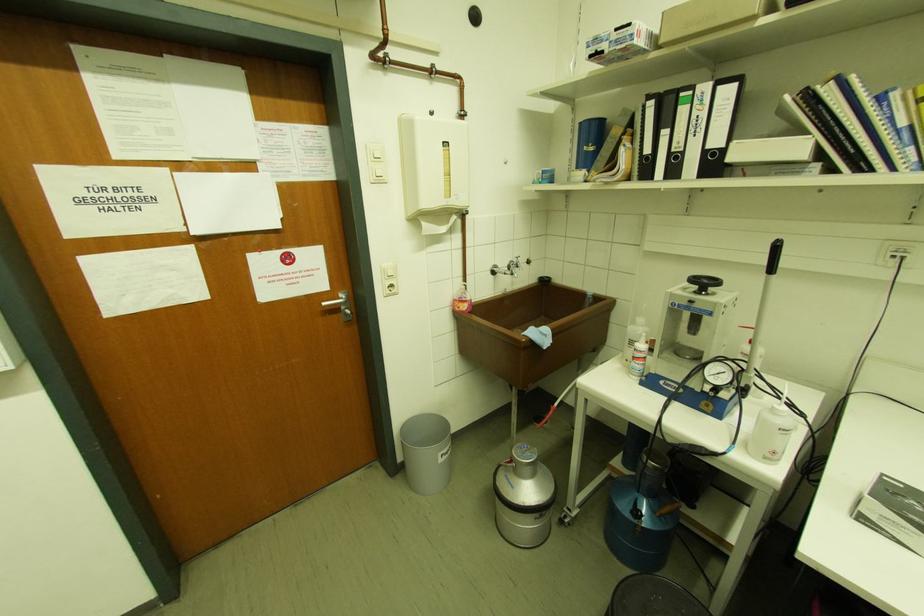
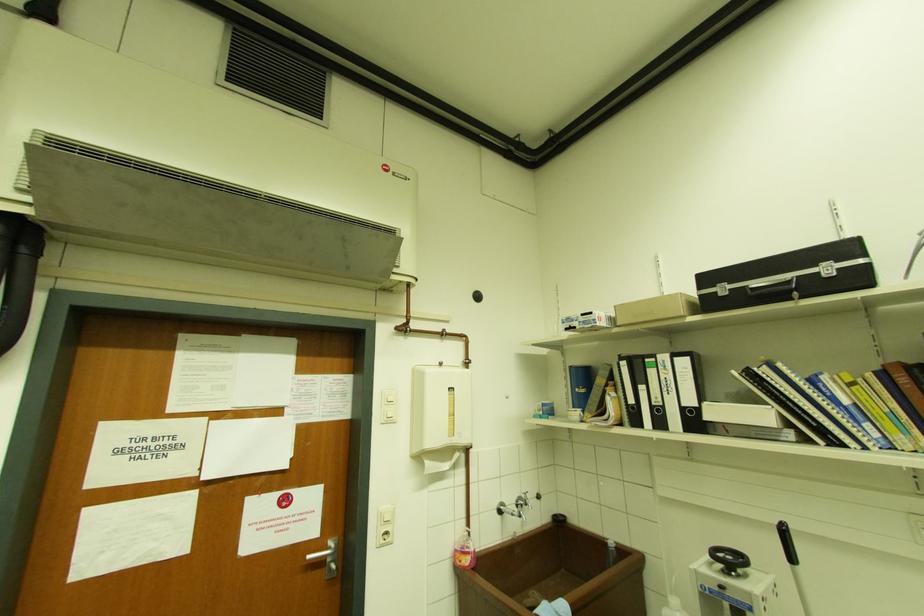
Question: The first image is from the beginning of the video and the second image is from the end. How did the camera likely rotate when shooting the video?

Choices:
 (A) Left
 (B) Right
 (C) Up
 (D) Down

Answer: (C)